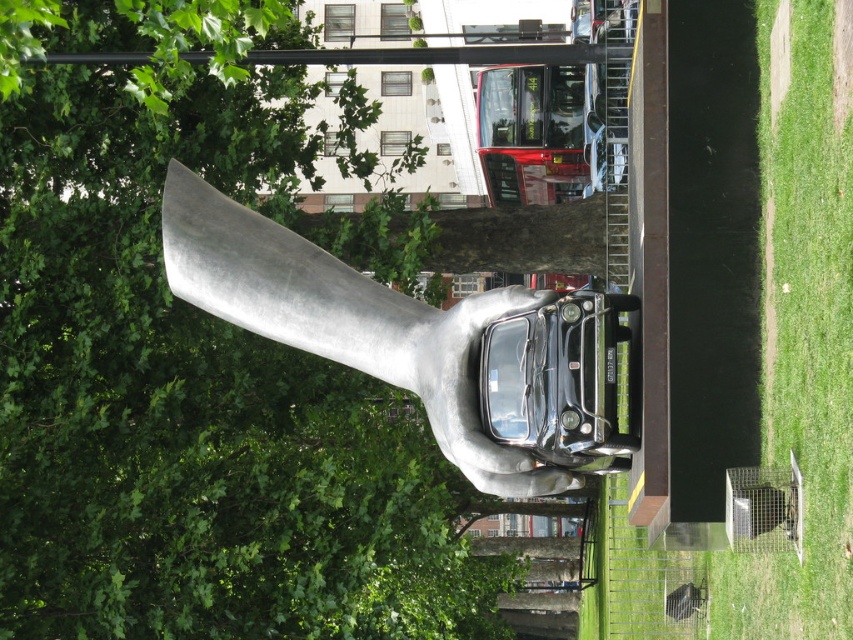
Does green leafy tree at upper center appear over shiny silver hand at center?

No.

Which is more to the right, green leafy tree at upper center or shiny silver hand at center?

shiny silver hand at center is more to the right.

Who is more forward, (79,612) or (260,262)?

Point (260,262) is more forward.

Find the location of a particular element. green leafy tree at upper center is located at coordinates point(190,372).

Is green grass at lower right to the right of shiny silver hand at center from the viewer's perspective?

Indeed, green grass at lower right is positioned on the right side of shiny silver hand at center.

Does green grass at lower right have a greater height compared to shiny silver hand at center?

Indeed, green grass at lower right has a greater height compared to shiny silver hand at center.

This screenshot has width=853, height=640. Describe the element at coordinates (752, 324) in the screenshot. I see `green grass at lower right` at that location.

Find the location of a particular element. This screenshot has width=853, height=640. green grass at lower right is located at coordinates (752, 324).

Does point (39, 488) come closer to viewer compared to point (724, 634)?

That is False.

Which is in front, point (62, 116) or point (807, 449)?

Point (807, 449) is in front.

Locate an element on the screen. The height and width of the screenshot is (640, 853). green leafy tree at upper center is located at coordinates (190, 372).

Where is `green leafy tree at upper center`? The width and height of the screenshot is (853, 640). green leafy tree at upper center is located at coordinates (190, 372).